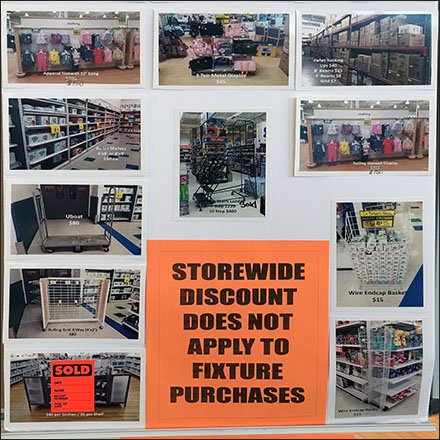
This screenshot has width=440, height=440. Identify the location of frame. click(294, 164).